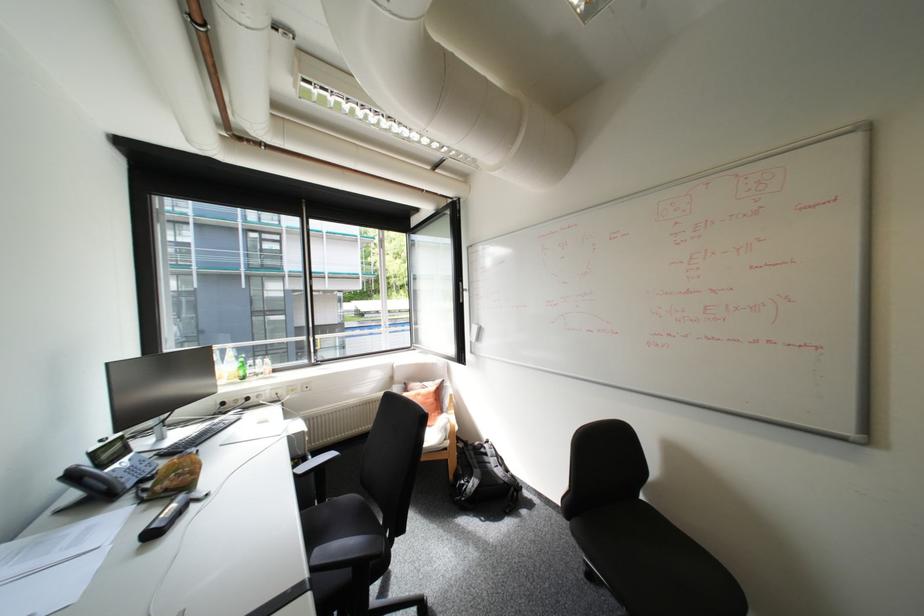
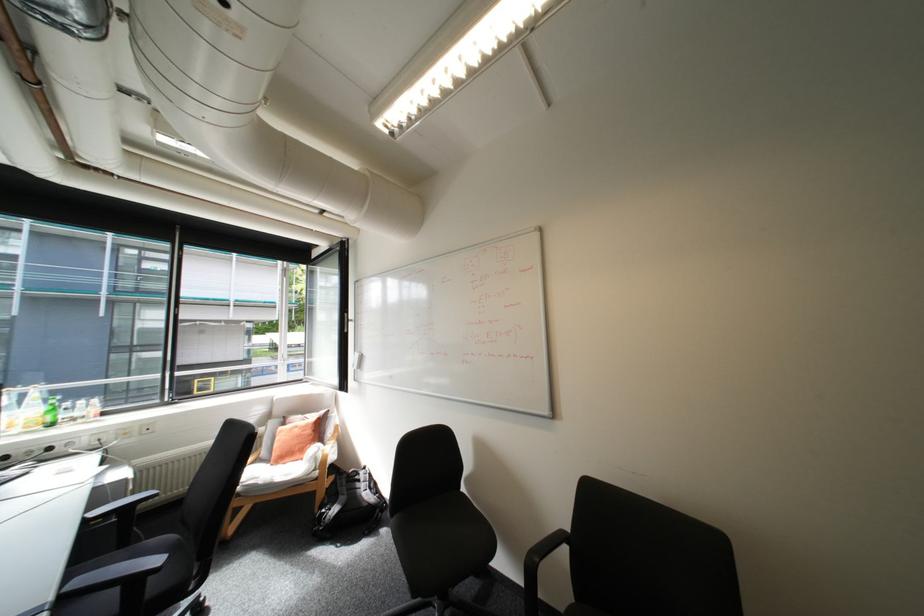
Locate, in the second image, the point that corresponds to [479,482] in the first image.

(339, 509)